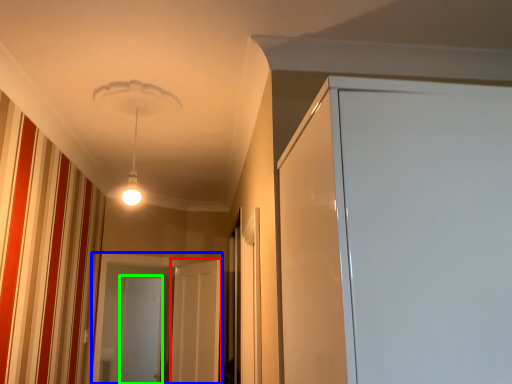
Question: Based on their relative distances, which object is nearer to screen door (highlighted by a red box)? Choose from screen door (highlighted by a blue box) and screen door (highlighted by a green box).

Choices:
 (A) screen door
 (B) screen door

Answer: (A)